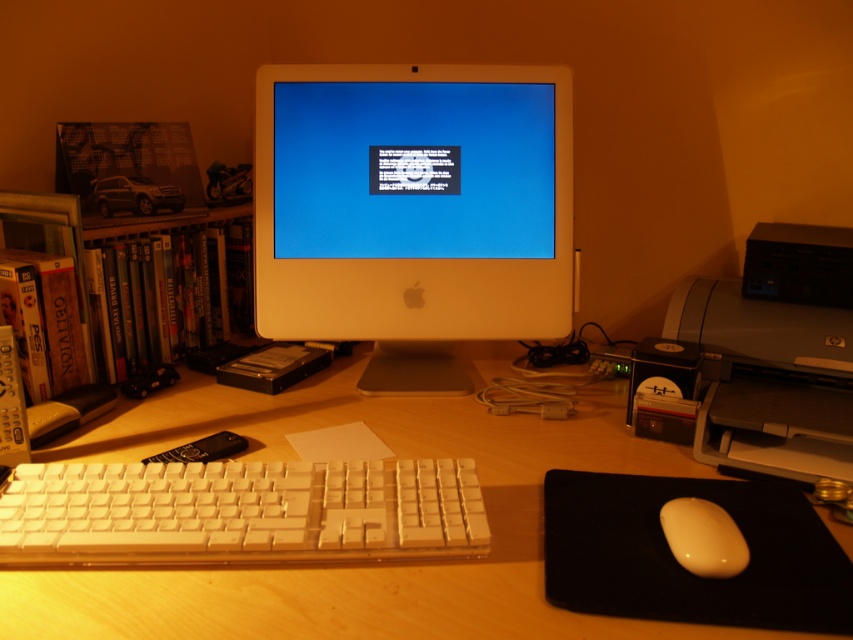
You are organizing your desk and need to place both the shiny plastic dvds at left and the matte yellow mouse at lower right into a drawer. The drawer has a height limit of 5 cm. Which item is more likely to exceed this limit based on their sizes?

The shiny plastic dvds at left is larger in size compared to the matte yellow mouse at lower right, so it is more likely to exceed the 5 cm height limit.

You are a delivery person who just arrived at this desk to drop off a package. The package is for the owner of the workspace and needs to be placed on the nearest available surface to the point marked at coordinates point (x=775, y=355). Which object should you place the package on?

The point (x=775, y=355) is on the matte gray printer at right, so you should place the package on the matte gray printer at right.

Looking at this image, you are organizing your desk and want to move the matte gray printer at right closer to the matte yellow mouse at lower right. Which direction should you move the printer to achieve this?

The matte gray printer at right is currently further away from the viewer than the matte yellow mouse at lower right. To move it closer to the mouse, you should move the printer forward towards the viewer.